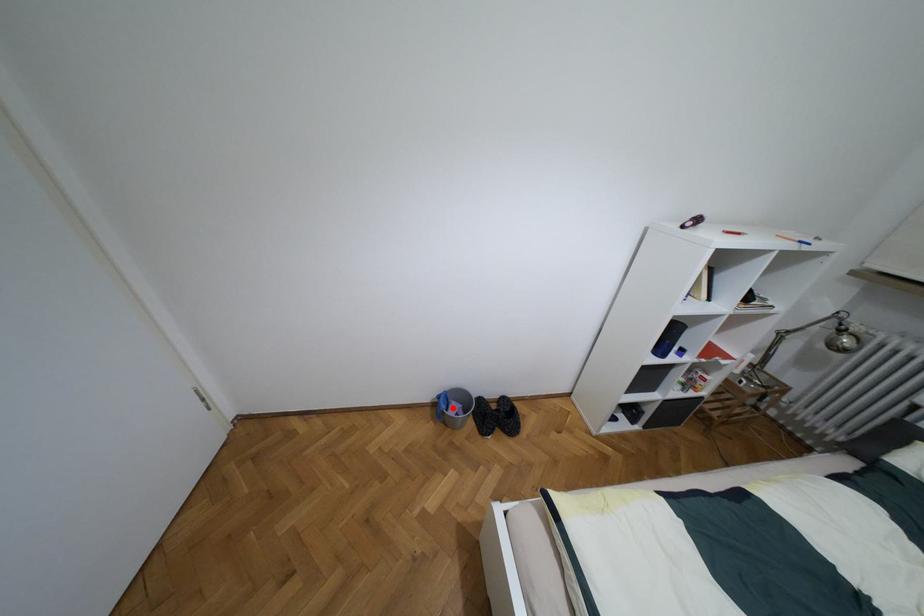
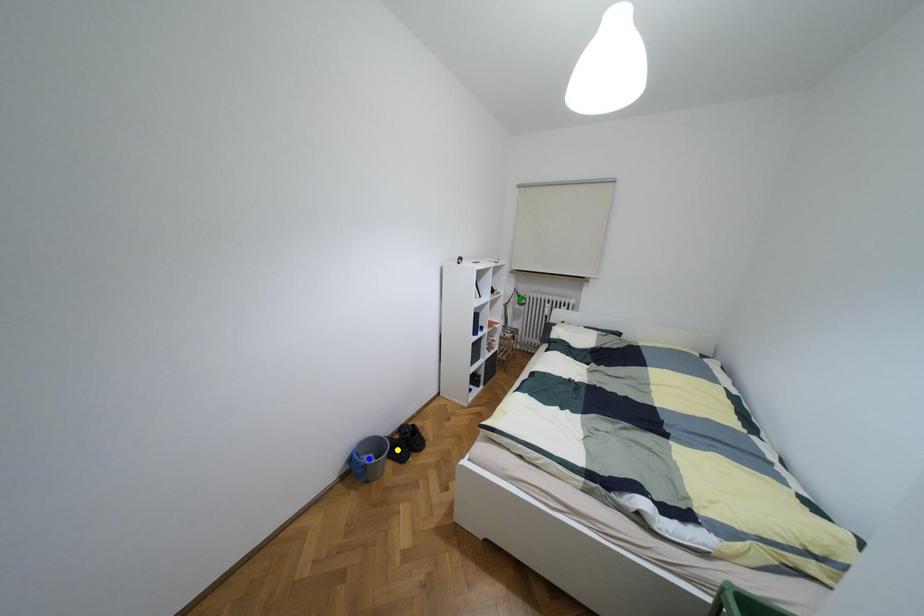
Question: I am providing you with two images of the same scene from different viewpoints. A red point is marked on the first image. You are given multiple points on the second image. Can you choose the point in image 2 that corresponds to the point in image 1?

Choices:
 (A) blue point
 (B) yellow point
 (C) green point

Answer: (A)